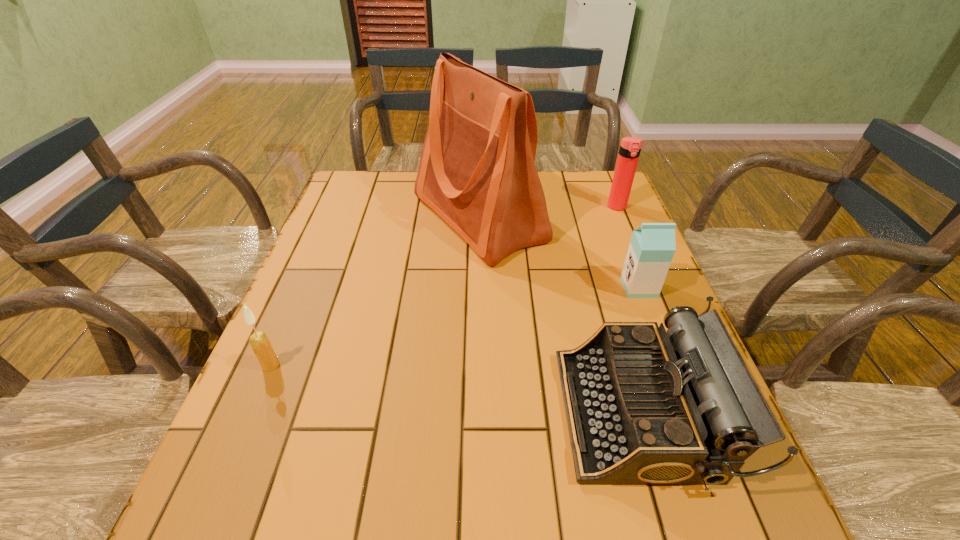
You are a GUI agent. You are given a task and a screenshot of the screen. Output one action in this format:
    pyautogui.click(x=<x>, y=<y>)
    Task: Click on the shopping bag
    This screenshot has width=960, height=540.
    Given the screenshot: What is the action you would take?
    pyautogui.click(x=477, y=172)

Where is `thermos bottle`? This screenshot has width=960, height=540. thermos bottle is located at coordinates (630, 147).

Locate an element on the screen. the third nearest object is located at coordinates (652, 246).

Find the location of a particular element. The image size is (960, 540). candle is located at coordinates (260, 344).

Locate an element on the screen. typewriter is located at coordinates (644, 406).

Identify the location of blank area located 0.210m on the left of the tallest object. The image size is (960, 540). pos(341,218).

Identify the location of free space located on the front of the second tallest object. The width and height of the screenshot is (960, 540). (632, 241).

In order to click on free space located 0.370m on the back of the third nearest object in this screenshot , I will do (x=605, y=200).

What are the coordinates of `vacant space situated on the back of the leftmost object` in the screenshot? It's located at (296, 308).

Image resolution: width=960 pixels, height=540 pixels. Identify the location of free region located 0.270m on the keyboard of the typewriter. (x=422, y=413).